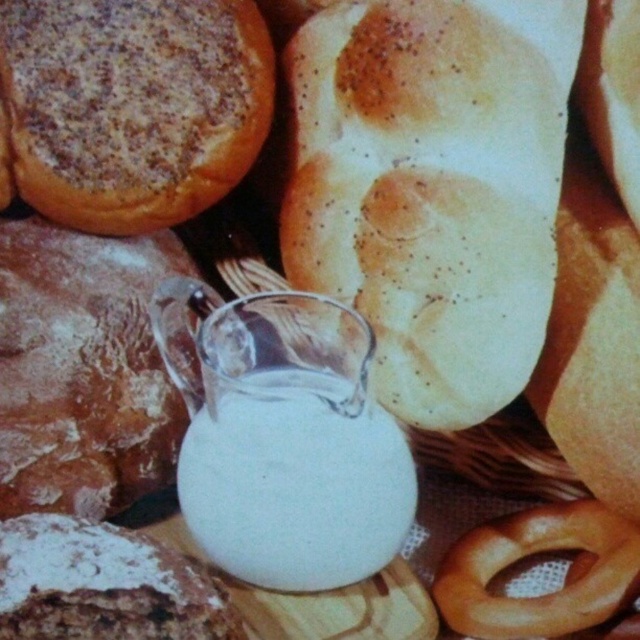
You are standing in front of the arrangement and want to pick up an item. Which of the two points, point (369, 109) or point (86, 506), is closer to you?

Point (369, 109) is closer to you because it is further to the viewer than point (86, 506).

You are a customer at a bakery and want to choose between the golden crusty bread at center and the white floury bread at center. Which one is more accessible to you?

The golden crusty bread at center is closer to you, so it is more accessible than the white floury bread at center.